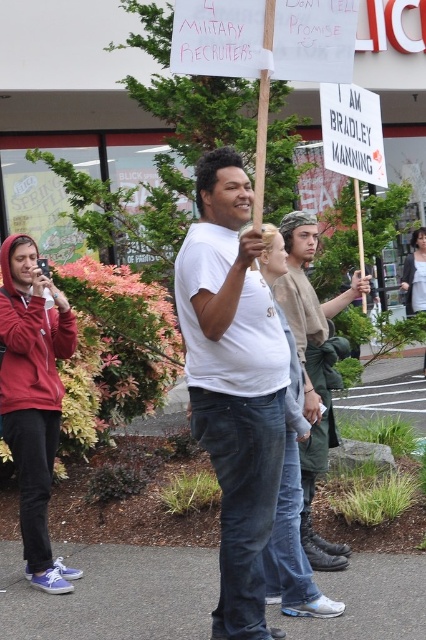
Question: Can you confirm if white matte t-shirt at center is smaller than matte red hoodie at left?

Choices:
 (A) no
 (B) yes

Answer: (A)

Question: Does white matte t-shirt at center come behind khaki cotton shirt at center?

Choices:
 (A) no
 (B) yes

Answer: (A)

Question: Can you confirm if matte red hoodie at left is thinner than khaki cotton shirt at center?

Choices:
 (A) yes
 (B) no

Answer: (A)

Question: Among these points, which one is farthest from the camera?

Choices:
 (A) (290, 307)
 (B) (3, 308)

Answer: (B)

Question: Which is nearer to the khaki cotton shirt at center?

Choices:
 (A) white matte t-shirt at center
 (B) matte red hoodie at left

Answer: (A)

Question: Estimate the real-world distances between objects in this image. Which object is farther from the white matte t-shirt at center?

Choices:
 (A) matte red hoodie at left
 (B) khaki cotton shirt at center

Answer: (A)